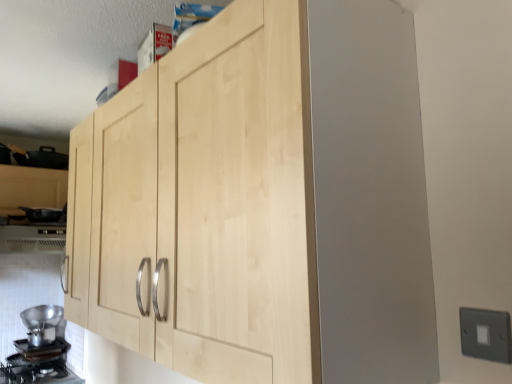
Question: From the image's perspective, is natural wood cabinet at center below metallic silver vent at lower left?

Choices:
 (A) yes
 (B) no

Answer: (B)

Question: Does natural wood cabinet at center have a lesser height compared to metallic silver vent at lower left?

Choices:
 (A) no
 (B) yes

Answer: (A)

Question: Is natural wood cabinet at center not close to metallic silver vent at lower left?

Choices:
 (A) no
 (B) yes

Answer: (B)

Question: Is natural wood cabinet at center oriented away from metallic silver vent at lower left?

Choices:
 (A) yes
 (B) no

Answer: (B)

Question: Can you confirm if natural wood cabinet at center is thinner than metallic silver vent at lower left?

Choices:
 (A) no
 (B) yes

Answer: (B)

Question: Is natural wood cabinet at center to the right of metallic silver vent at lower left from the viewer's perspective?

Choices:
 (A) yes
 (B) no

Answer: (A)

Question: Can you confirm if metallic silver funnel at lower left is wider than gray plastic switch at lower right?

Choices:
 (A) no
 (B) yes

Answer: (B)

Question: From a real-world perspective, is metallic silver funnel at lower left on gray plastic switch at lower right?

Choices:
 (A) no
 (B) yes

Answer: (A)

Question: Is metallic silver funnel at lower left positioned far away from gray plastic switch at lower right?

Choices:
 (A) yes
 (B) no

Answer: (A)

Question: Does metallic silver funnel at lower left lie in front of gray plastic switch at lower right?

Choices:
 (A) no
 (B) yes

Answer: (A)

Question: From the image's perspective, is metallic silver funnel at lower left under gray plastic switch at lower right?

Choices:
 (A) yes
 (B) no

Answer: (A)

Question: Does metallic silver funnel at lower left have a greater height compared to gray plastic switch at lower right?

Choices:
 (A) no
 (B) yes

Answer: (B)

Question: Is metallic silver funnel at lower left at the left side of black matte gas stove at lower left?

Choices:
 (A) no
 (B) yes

Answer: (A)